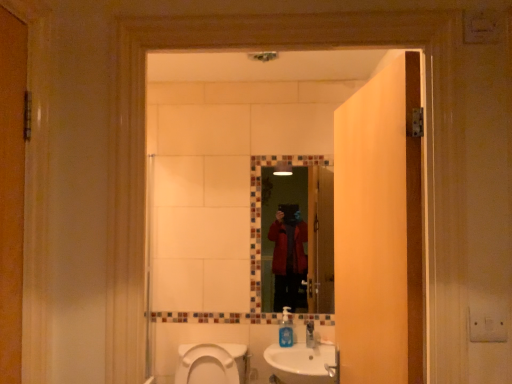
The image size is (512, 384). What do you see at coordinates (286, 328) in the screenshot? I see `blue translucent soap dispenser at lower center` at bounding box center [286, 328].

Where is `blue translucent soap dispenser at lower center`? This screenshot has width=512, height=384. blue translucent soap dispenser at lower center is located at coordinates (286, 328).

This screenshot has height=384, width=512. What do you see at coordinates (212, 364) in the screenshot?
I see `white glossy toilet at lower center` at bounding box center [212, 364].

This screenshot has width=512, height=384. Identify the location of glass mosaic mirror at center. (305, 232).

What do you see at coordinates (301, 363) in the screenshot? The image size is (512, 384). I see `white ceramic sink at lower center` at bounding box center [301, 363].

What are the coordinates of `blue translucent soap dispenser at lower center` in the screenshot? It's located at (286, 328).

This screenshot has height=384, width=512. In order to click on door on the right side of glass mosaic mirror at center in this screenshot , I will do `click(379, 229)`.

From the image's perspective, which one is positioned lower, wooden door at center or glass mosaic mirror at center?

glass mosaic mirror at center is shown below in the image.

From a real-world perspective, is wooden door at center physically located above or below glass mosaic mirror at center?

From a real-world perspective, wooden door at center is physically above glass mosaic mirror at center.

Is wooden door at center positioned with its back to glass mosaic mirror at center?

No, glass mosaic mirror at center is not at the back of wooden door at center.

In terms of size, does white ceramic sink at lower center appear bigger or smaller than wooden door at center?

Considering their sizes, white ceramic sink at lower center takes up less space than wooden door at center.

Which of these two, white ceramic sink at lower center or wooden door at center, is wider?

Wider between the two is white ceramic sink at lower center.

Which object is positioned more to the right, white ceramic sink at lower center or wooden door at center?

From the viewer's perspective, wooden door at center appears more on the right side.

Is white ceramic sink at lower center wider than white glossy toilet at lower center?

Incorrect, the width of white ceramic sink at lower center does not surpass that of white glossy toilet at lower center.

Considering the positions of objects white ceramic sink at lower center and white glossy toilet at lower center in the image provided, who is behind, white ceramic sink at lower center or white glossy toilet at lower center?

white ceramic sink at lower center is more distant.

In the scene shown: How different are the orientations of white ceramic sink at lower center and white glossy toilet at lower center in degrees?

0.722 degrees separate the facing orientations of white ceramic sink at lower center and white glossy toilet at lower center.

Between white ceramic sink at lower center and white glossy toilet at lower center, which one has less height?

white glossy toilet at lower center.

Find the location of a particular element. This screenshot has height=384, width=512. door in front of the blue translucent soap dispenser at lower center is located at coordinates (379, 229).

Is point (281, 338) behind point (399, 240)?

Yes.

Is blue translucent soap dispenser at lower center taller than wooden door at center?

No, blue translucent soap dispenser at lower center is not taller than wooden door at center.

From the image's perspective, is blue translucent soap dispenser at lower center above wooden door at center?

No, from the image's perspective, blue translucent soap dispenser at lower center is not on top of wooden door at center.

The height and width of the screenshot is (384, 512). Find the location of `sink below the blue translucent soap dispenser at lower center (from a real-world perspective)`. sink below the blue translucent soap dispenser at lower center (from a real-world perspective) is located at coordinates (301, 363).

From the image's perspective, is white ceramic sink at lower center below blue translucent soap dispenser at lower center?

Yes.

From a real-world perspective, who is located lower, white ceramic sink at lower center or blue translucent soap dispenser at lower center?

white ceramic sink at lower center, from a real-world perspective.

Looking at this image, is white ceramic sink at lower center surrounding blue translucent soap dispenser at lower center?

Yes, blue translucent soap dispenser at lower center can be found within white ceramic sink at lower center.

From the image's perspective, does glass mosaic mirror at center appear lower than white ceramic sink at lower center?

No, from the image's perspective, glass mosaic mirror at center is not beneath white ceramic sink at lower center.

Does point (298, 193) appear closer or farther from the camera than point (321, 373)?

Point (298, 193) is farther from the camera than point (321, 373).

Is glass mosaic mirror at center aimed at white ceramic sink at lower center?

No, glass mosaic mirror at center is not aimed at white ceramic sink at lower center.

Considering the relative sizes of glass mosaic mirror at center and white ceramic sink at lower center in the image provided, is glass mosaic mirror at center bigger than white ceramic sink at lower center?

Incorrect, glass mosaic mirror at center is not larger than white ceramic sink at lower center.

Which is further, (201, 370) or (286, 324)?

Point (286, 324)

From a real-world perspective, is white glossy toilet at lower center below blue translucent soap dispenser at lower center?

Indeed, from a real-world perspective, white glossy toilet at lower center is positioned beneath blue translucent soap dispenser at lower center.

Is white glossy toilet at lower center to the right of blue translucent soap dispenser at lower center from the viewer's perspective?

No.

Which object is wider, white glossy toilet at lower center or blue translucent soap dispenser at lower center?

With larger width is white glossy toilet at lower center.

Find the location of `mirror on the left side of wooden door at center`. mirror on the left side of wooden door at center is located at coordinates (305, 232).

Find the location of a particular element. The width and height of the screenshot is (512, 384). door above the white ceramic sink at lower center (from the image's perspective) is located at coordinates (379, 229).

Estimate the real-world distances between objects in this image. Which object is further from wooden door at center, white glossy toilet at lower center or white ceramic sink at lower center?

white glossy toilet at lower center lies further to wooden door at center than the other object.

Estimate the real-world distances between objects in this image. Which object is closer to blue translucent soap dispenser at lower center, wooden door at center or white ceramic sink at lower center?

white ceramic sink at lower center lies closer to blue translucent soap dispenser at lower center than the other object.

Looking at the image, which one is located further to glass mosaic mirror at center, wooden door at center or white glossy toilet at lower center?

Based on the image, wooden door at center appears to be further to glass mosaic mirror at center.

Which object lies further to the anchor point glass mosaic mirror at center, white glossy toilet at lower center or wooden door at center?

Among the two, wooden door at center is located further to glass mosaic mirror at center.

From the image, which object appears to be nearer to blue translucent soap dispenser at lower center, glass mosaic mirror at center or wooden door at center?

Among the two, glass mosaic mirror at center is located nearer to blue translucent soap dispenser at lower center.

Estimate the real-world distances between objects in this image. Which object is closer to white glossy toilet at lower center, glass mosaic mirror at center or wooden door at center?

glass mosaic mirror at center is positioned closer to the anchor white glossy toilet at lower center.

Estimate the real-world distances between objects in this image. Which object is closer to blue translucent soap dispenser at lower center, wooden door at center or glass mosaic mirror at center?

Based on the image, glass mosaic mirror at center appears to be nearer to blue translucent soap dispenser at lower center.

Looking at the image, which one is located closer to blue translucent soap dispenser at lower center, white glossy toilet at lower center or glass mosaic mirror at center?

white glossy toilet at lower center is closer to blue translucent soap dispenser at lower center.

Where is `toilet between wooden door at center and glass mosaic mirror at center from front to back`? The height and width of the screenshot is (384, 512). toilet between wooden door at center and glass mosaic mirror at center from front to back is located at coordinates click(x=212, y=364).

You are a GUI agent. You are given a task and a screenshot of the screen. Output one action in this format:
    pyautogui.click(x=<x>, y=<y>)
    Task: Click on the sink positioned between wooden door at center and glass mosaic mirror at center from near to far
    The height and width of the screenshot is (384, 512).
    Given the screenshot: What is the action you would take?
    pyautogui.click(x=301, y=363)

Identify the location of soap dispenser between glass mosaic mirror at center and white ceramic sink at lower center vertically. (286, 328).

I want to click on toilet between wooden door at center and blue translucent soap dispenser at lower center from front to back, so click(x=212, y=364).